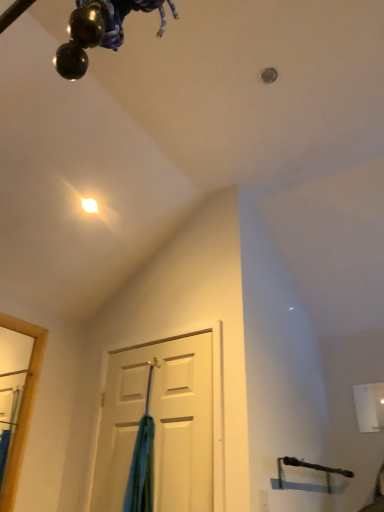
Question: Is white matte door at center smaller than blue fabric at center?

Choices:
 (A) no
 (B) yes

Answer: (A)

Question: Considering the relative sizes of white matte door at center and blue fabric at center in the image provided, is white matte door at center thinner than blue fabric at center?

Choices:
 (A) no
 (B) yes

Answer: (B)

Question: Is there a large distance between white matte door at center and blue fabric at center?

Choices:
 (A) yes
 (B) no

Answer: (B)

Question: Does white matte door at center contain blue fabric at center?

Choices:
 (A) no
 (B) yes

Answer: (A)

Question: Is white matte door at center to the right of blue fabric at center from the viewer's perspective?

Choices:
 (A) yes
 (B) no

Answer: (A)

Question: Considering the relative sizes of white matte door at center and blue fabric at center in the image provided, is white matte door at center wider than blue fabric at center?

Choices:
 (A) no
 (B) yes

Answer: (A)

Question: Is blue fabric at center next to white matte door at center?

Choices:
 (A) no
 (B) yes

Answer: (A)

Question: Does blue fabric at center turn towards white matte door at center?

Choices:
 (A) yes
 (B) no

Answer: (A)

Question: Is white matte door at center inside blue fabric at center?

Choices:
 (A) yes
 (B) no

Answer: (B)

Question: From a real-world perspective, is blue fabric at center positioned over white matte door at center based on gravity?

Choices:
 (A) yes
 (B) no

Answer: (B)

Question: Is blue fabric at center further to camera compared to white matte door at center?

Choices:
 (A) no
 (B) yes

Answer: (B)

Question: From a real-world perspective, is blue fabric at center located beneath white matte door at center?

Choices:
 (A) yes
 (B) no

Answer: (A)

Question: From a real-world perspective, is white matte door at center physically located above or below blue fabric at center?

Choices:
 (A) below
 (B) above

Answer: (B)